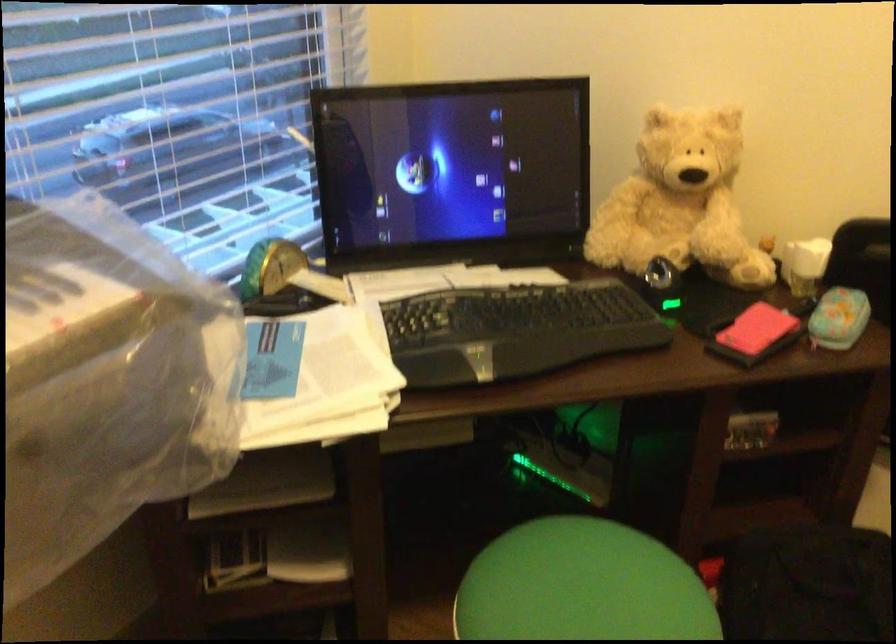
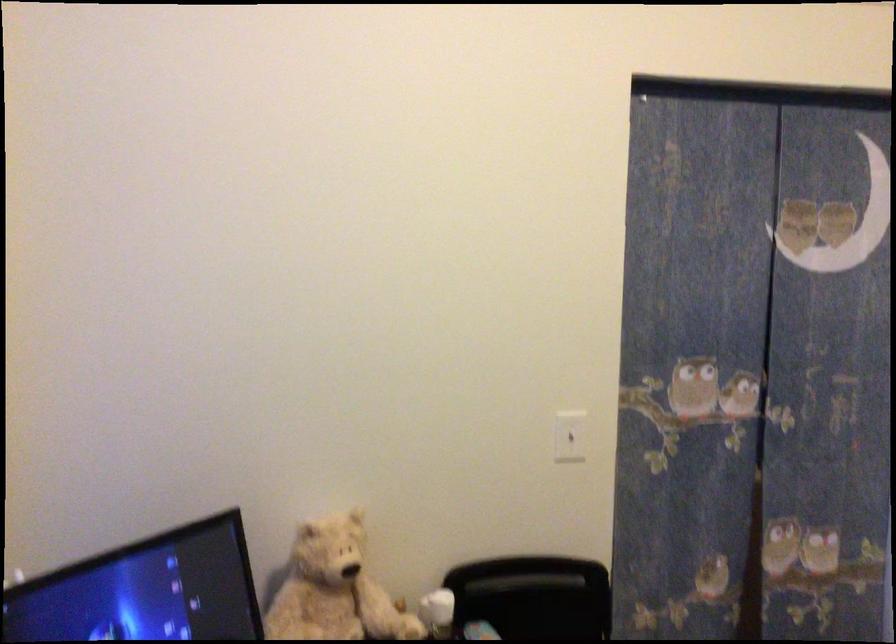
In the second image, find the point that corresponds to point (806, 251) in the first image.

(437, 612)